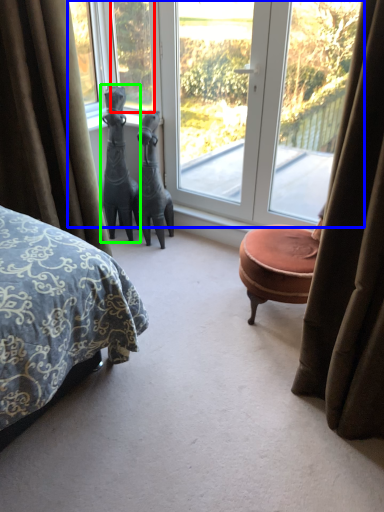
Question: Which object is positioned closest to window (highlighted by a red box)? Select from window (highlighted by a blue box) and sculpture (highlighted by a green box).

Choices:
 (A) window
 (B) sculpture

Answer: (A)